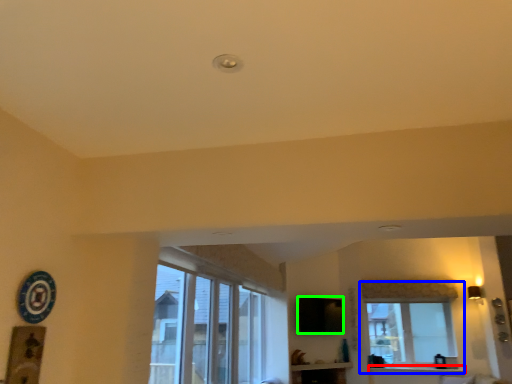
Question: Which is nearer to the window sill (highlighted by a red box)? window (highlighted by a blue box) or window screen (highlighted by a green box).

Choices:
 (A) window
 (B) window screen

Answer: (A)